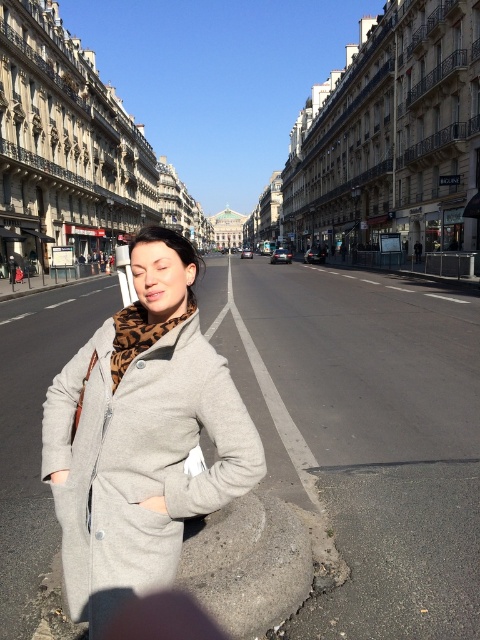
Question: Which object is closer to the camera taking this photo?

Choices:
 (A) gray wool coat at center
 (B) smooth concrete curb at lower center

Answer: (A)

Question: Which point is farther to the camera?

Choices:
 (A) (49, 432)
 (B) (290, 586)

Answer: (B)

Question: Considering the relative positions of gray wool coat at center and smooth concrete curb at lower center in the image provided, where is gray wool coat at center located with respect to smooth concrete curb at lower center?

Choices:
 (A) left
 (B) right

Answer: (A)

Question: Among these points, which one is nearest to the camera?

Choices:
 (A) (128, 573)
 (B) (224, 618)

Answer: (A)

Question: Is gray wool coat at center above smooth concrete curb at lower center?

Choices:
 (A) yes
 (B) no

Answer: (A)

Question: Does gray wool coat at center appear on the left side of smooth concrete curb at lower center?

Choices:
 (A) yes
 (B) no

Answer: (A)